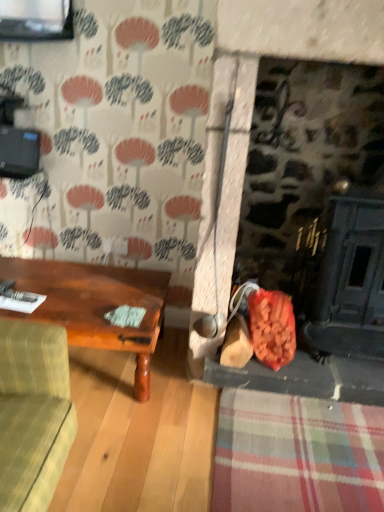
Identify the location of wooden table at center. (94, 305).

The height and width of the screenshot is (512, 384). What do you see at coordinates (94, 305) in the screenshot? I see `wooden table at center` at bounding box center [94, 305].

In order to face wooden table at center, should I rotate leftwards or rightwards?

It's best to rotate left around 16.813 degrees.

Image resolution: width=384 pixels, height=512 pixels. Identify the location of wooden table at center. (94, 305).